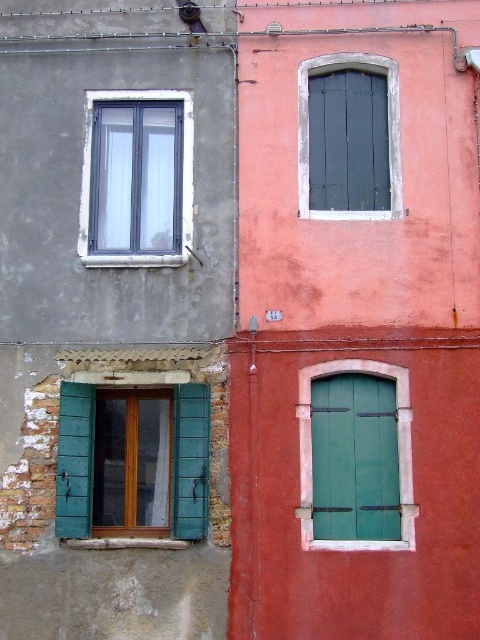
Does green matte door at center lie behind matte black window at center?

No.

Find the location of a particular element. green matte door at center is located at coordinates (396, 445).

Who is higher up, green wooden window at center or white plastic window at upper left?

white plastic window at upper left is above.

Consider the image. Does green wooden window at center have a greater height compared to white plastic window at upper left?

No.

Between point (183, 458) and point (189, 204), which one is positioned behind?

Point (189, 204)

Locate an element on the screen. The image size is (480, 640). green wooden window at center is located at coordinates (75, 460).

Who is more distant from viewer, (400, 163) or (192, 188)?

The point (192, 188) is more distant.

At what (x,y) coordinates should I click in order to perform the action: click on matte black window at center. Please return your answer as a coordinate pair (x, y). Looking at the image, I should click on (387, 132).